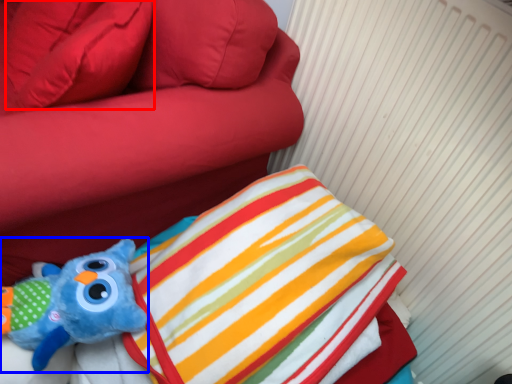
Question: Which object appears closest to the camera in this image, pillow (highlighted by a red box) or toy (highlighted by a blue box)?

Choices:
 (A) pillow
 (B) toy

Answer: (B)